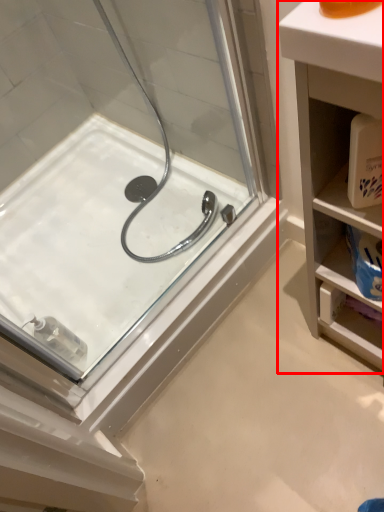
Question: Where is bathroom cabinet (annotated by the red box) located in relation to bath in the image?

Choices:
 (A) right
 (B) left

Answer: (A)